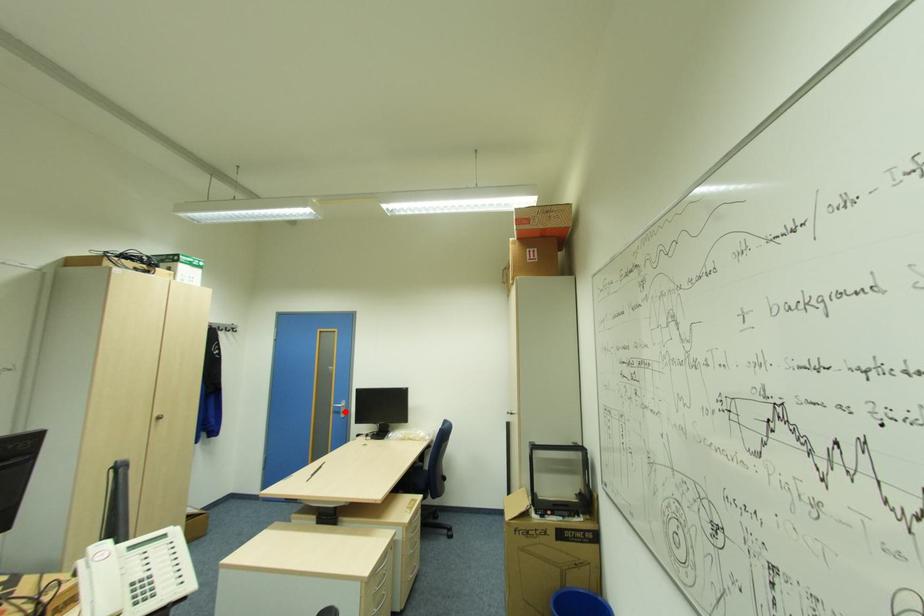
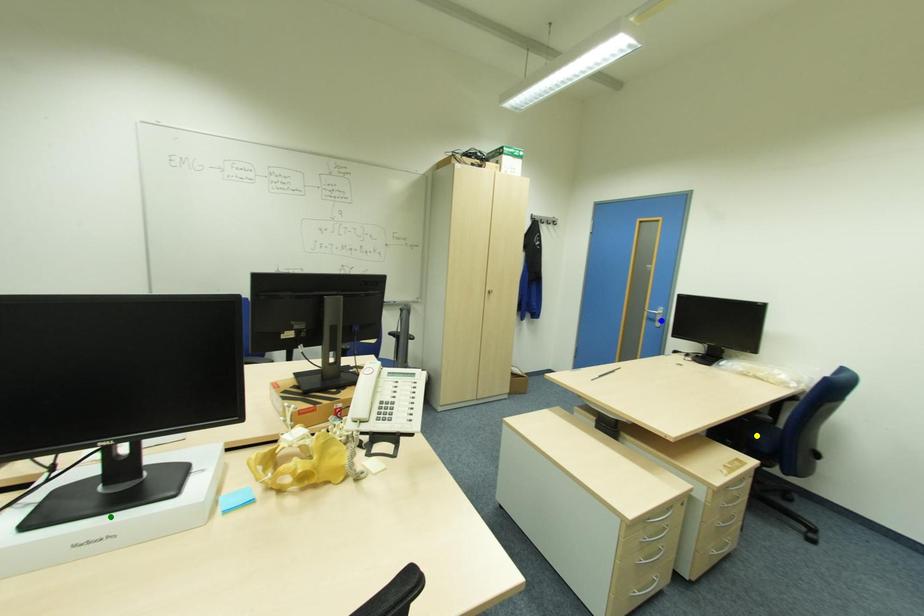
Question: I am providing you with two images of the same scene from different viewpoints. A red point is marked on the first image. You are given multiple points on the second image. Which mark in image 2 goes with the point in image 1?

Choices:
 (A) yellow point
 (B) blue point
 (C) green point

Answer: (B)